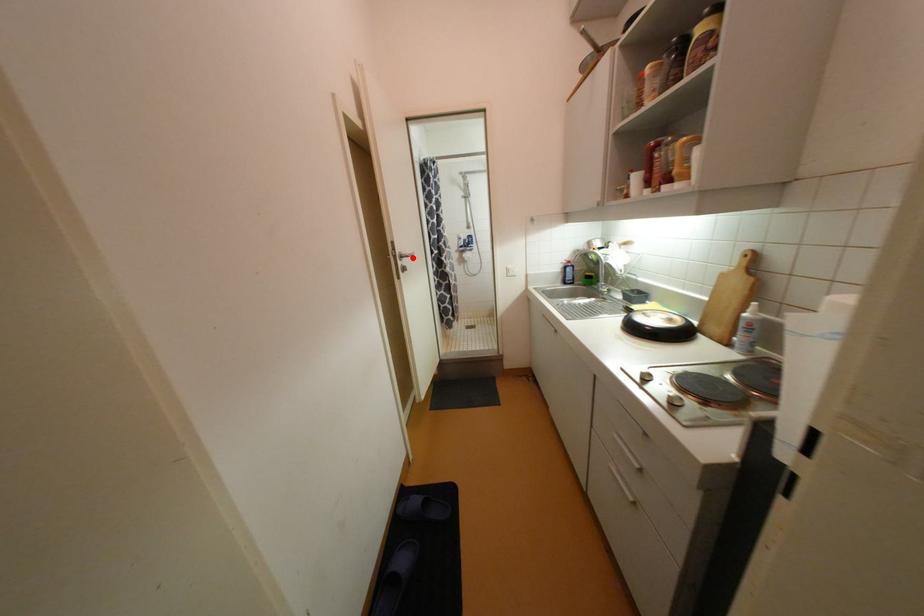
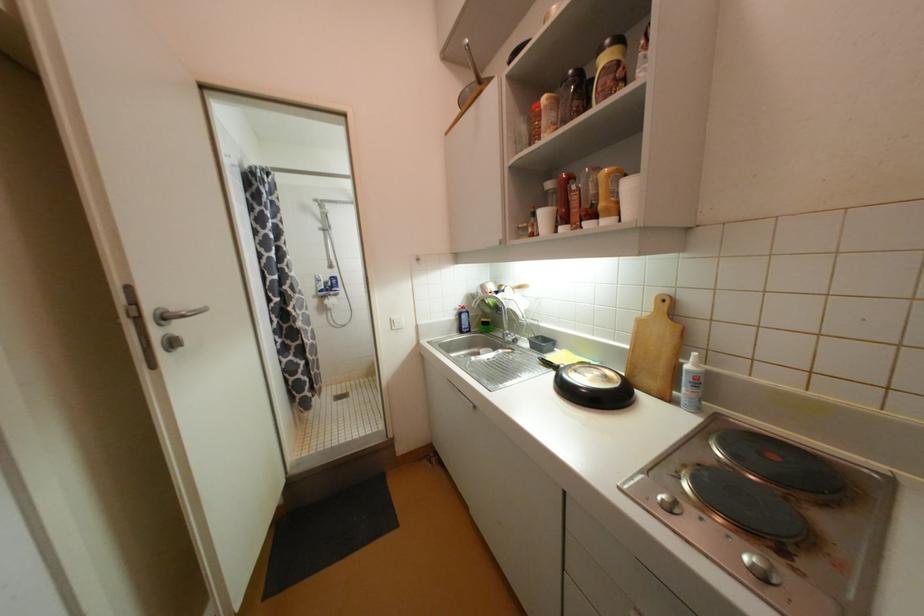
Locate, in the second image, the point that corresponds to the highlighted location in the first image.

(188, 318)